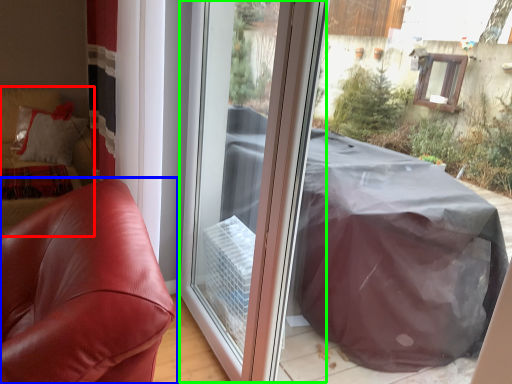
Question: Which object is the closest to the couch (highlighted by a red box)? Choose among these: furniture (highlighted by a blue box) or screen door (highlighted by a green box).

Choices:
 (A) furniture
 (B) screen door

Answer: (B)